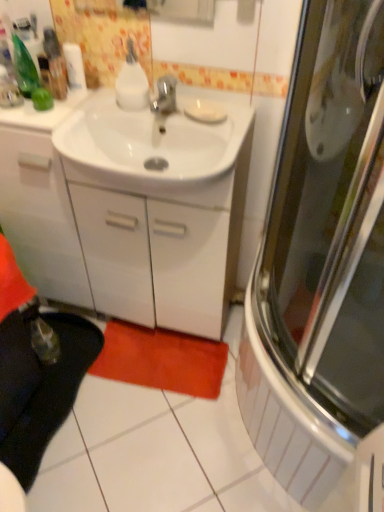
Where is `free point in front of white matte soap at center`? This screenshot has width=384, height=512. free point in front of white matte soap at center is located at coordinates (220, 130).